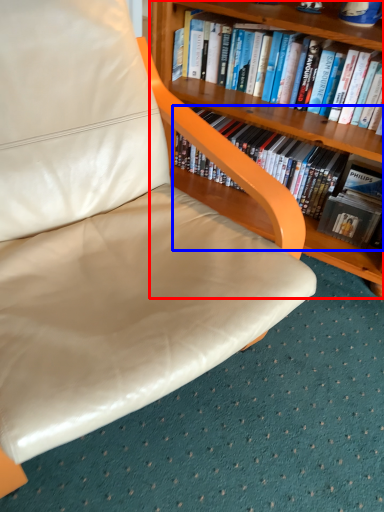
Question: Among these objects, which one is nearest to the camera, bookcase (highlighted by a red box) or book (highlighted by a blue box)?

Choices:
 (A) bookcase
 (B) book

Answer: (A)